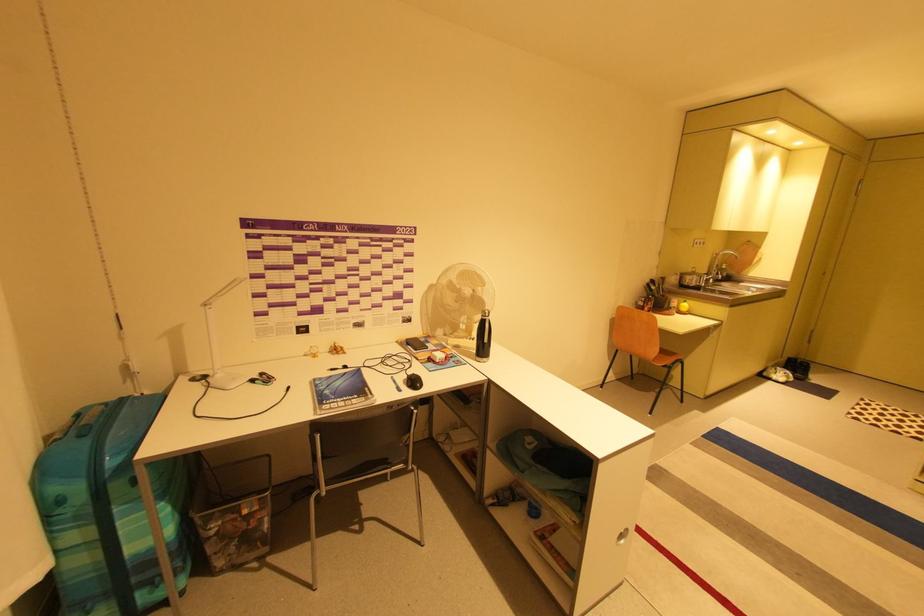
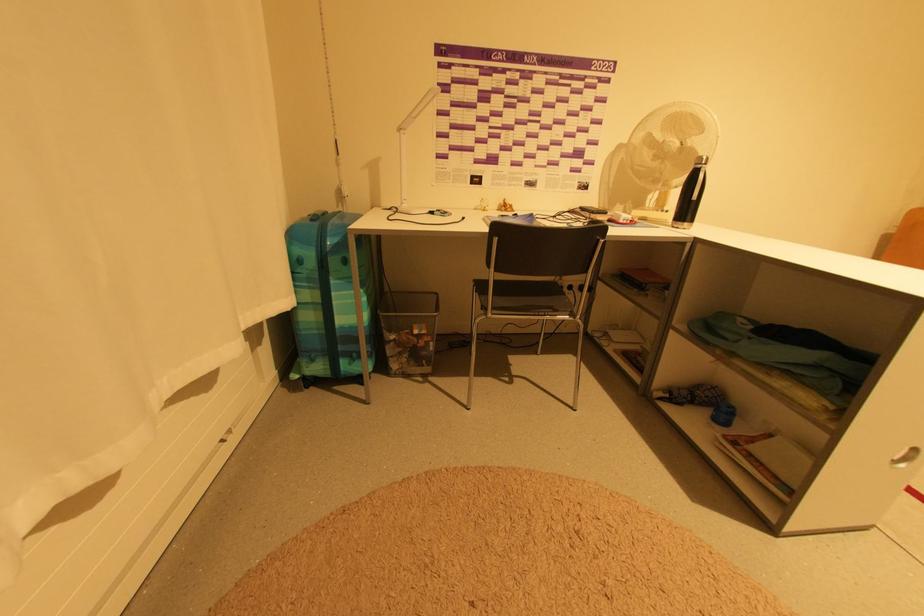
Question: The camera is either moving clockwise (left) or counter-clockwise (right) around the object. The first image is from the beginning of the video and the second image is from the end. Is the camera moving left or right when shooting the video?

Choices:
 (A) Left
 (B) Right

Answer: (B)